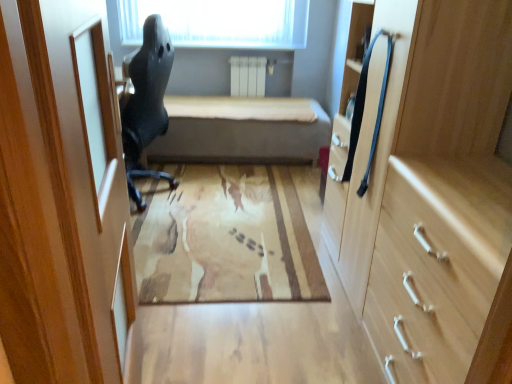
At what (x,y) coordinates should I click in order to perform the action: click on vacant space to the right of matte black chair at left. Please return your answer as a coordinate pair (x, y). This screenshot has width=512, height=384. Looking at the image, I should click on (210, 198).